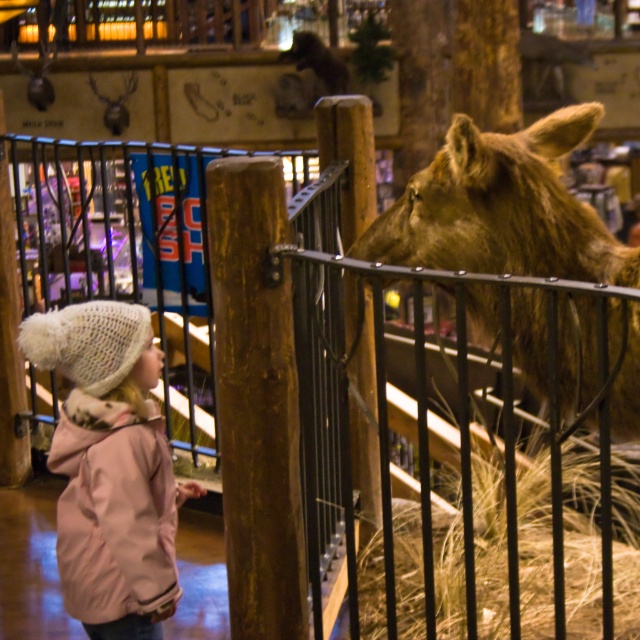
Question: Which point is farther to the camera?

Choices:
 (A) pink fleece jacket at lower left
 (B) brown furry moose at upper right

Answer: (A)

Question: Considering the relative positions of brown furry moose at upper right and pink fleece jacket at lower left in the image provided, where is brown furry moose at upper right located with respect to pink fleece jacket at lower left?

Choices:
 (A) above
 (B) below

Answer: (A)

Question: Is brown furry moose at upper right behind pink fleece jacket at lower left?

Choices:
 (A) no
 (B) yes

Answer: (A)

Question: Which point is closer to the camera taking this photo?

Choices:
 (A) coord(572,381)
 (B) coord(144,493)

Answer: (B)

Question: Is brown furry moose at upper right to the left of pink fleece jacket at lower left from the viewer's perspective?

Choices:
 (A) no
 (B) yes

Answer: (A)